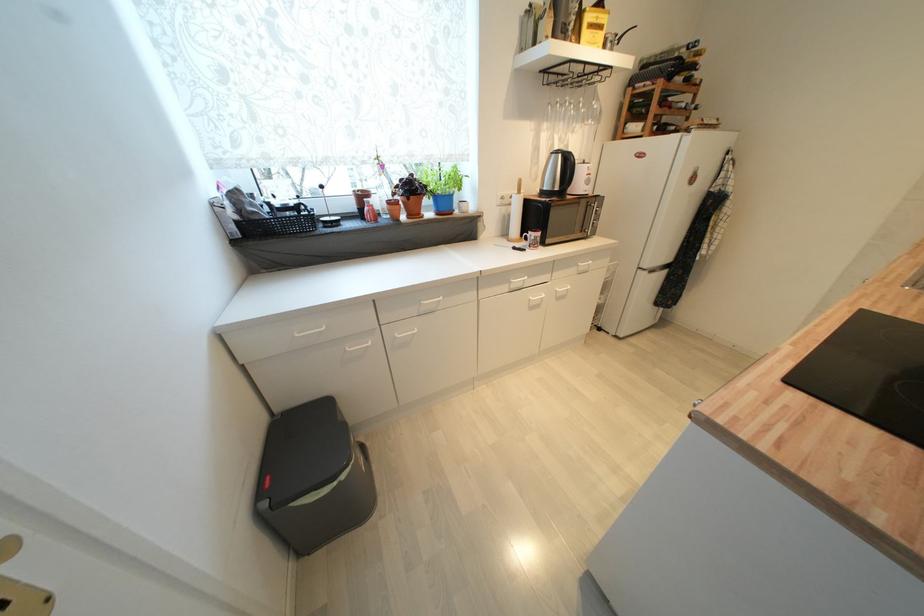
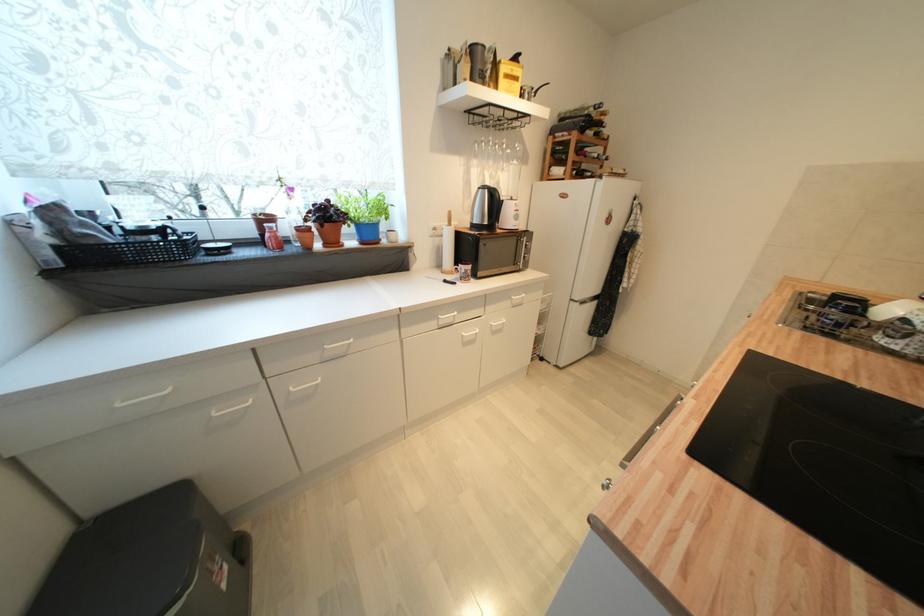
Question: The camera is either moving clockwise (left) or counter-clockwise (right) around the object. The first image is from the beginning of the video and the second image is from the end. Is the camera moving left or right when shooting the video?

Choices:
 (A) Left
 (B) Right

Answer: (A)